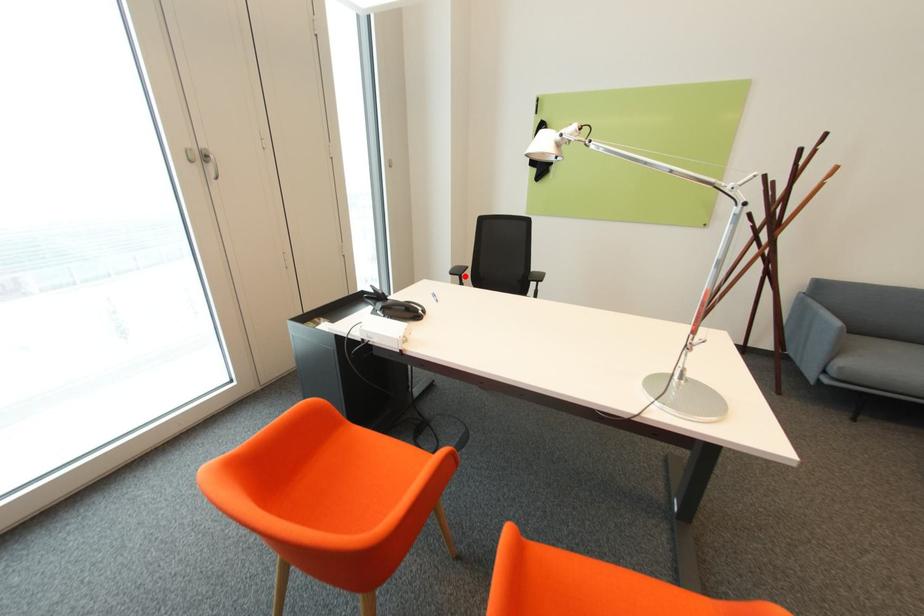
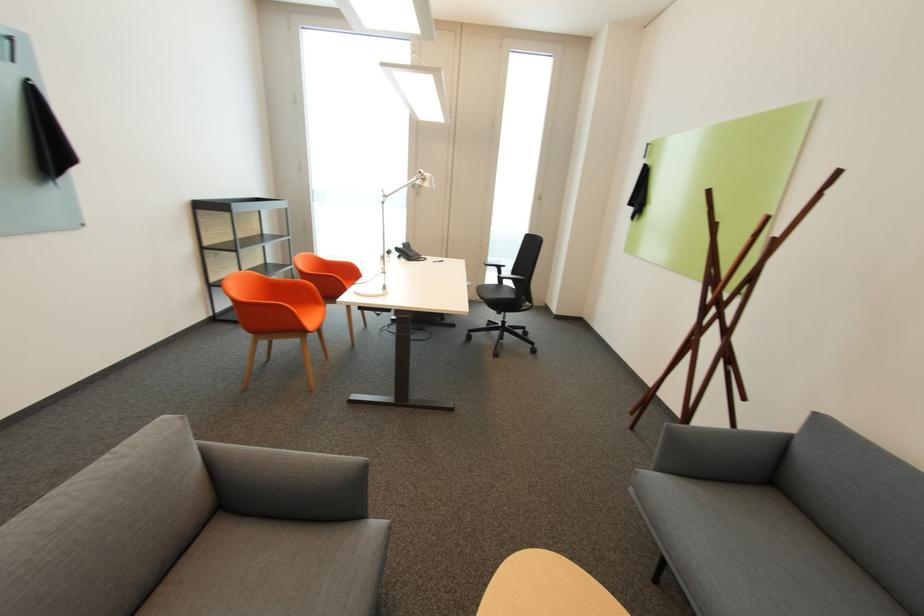
The point at the highlighted location is marked in the first image. Where is the corresponding point in the second image?

(503, 269)